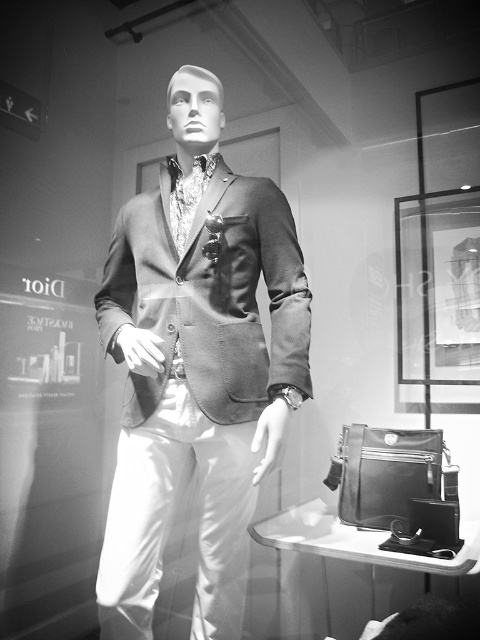
Between satin-like brown blazer at center and suede-like brown jacket at center, which one appears on the right side from the viewer's perspective?

Positioned to the right is suede-like brown jacket at center.

Is point (143, 550) less distant than point (273, 276)?

Yes.

Does point (255, 344) come farther from viewer compared to point (215, 307)?

Yes, point (255, 344) is behind point (215, 307).

Image resolution: width=480 pixels, height=640 pixels. What are the coordinates of `satin-like brown blazer at center` in the screenshot? It's located at (196, 364).

Which is more to the left, suede-like brown jacket at center or glass frame at upper right?

From the viewer's perspective, suede-like brown jacket at center appears more on the left side.

Who is more forward, (144, 413) or (441, 109)?

Point (144, 413) is in front.

This screenshot has width=480, height=640. Identify the location of suede-like brown jacket at center. (211, 296).

Can you confirm if satin-like brown blazer at center is thinner than glass frame at upper right?

Incorrect, satin-like brown blazer at center's width is not less than glass frame at upper right's.

Is point (136, 627) farther from viewer compared to point (477, 285)?

No, it is not.

Locate an element on the screen. The height and width of the screenshot is (640, 480). satin-like brown blazer at center is located at coordinates (196, 364).